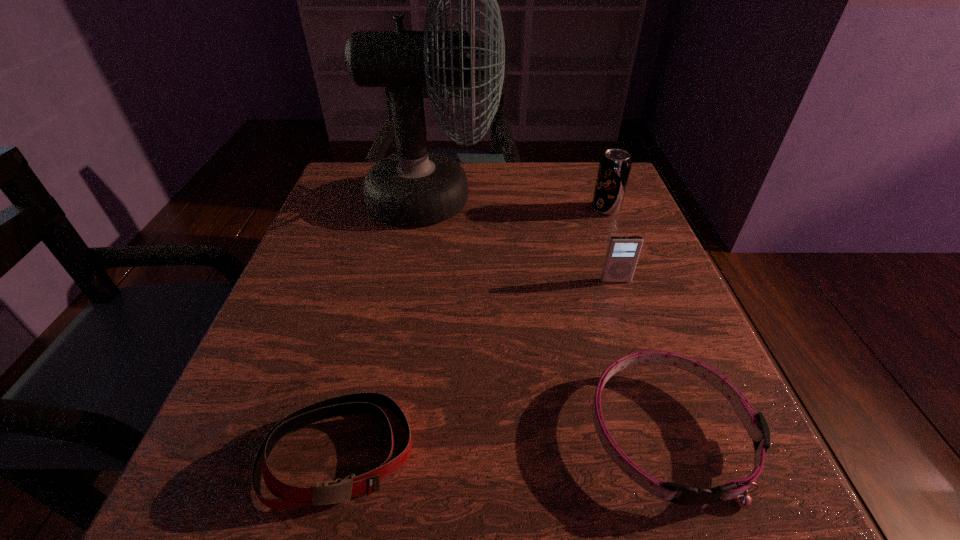
Locate an element on the screen. object at the near right corner is located at coordinates pos(756,425).

In the image, there is a desktop. Identify the location of vacant space at the far edge. [x=467, y=163].

This screenshot has width=960, height=540. What are the coordinates of `free space at the near edge of the desktop` in the screenshot? It's located at (564, 516).

In the image, there is a desktop. Where is `vacant space at the left edge`? Image resolution: width=960 pixels, height=540 pixels. vacant space at the left edge is located at coordinates (353, 276).

In the image, there is a desktop. In order to click on free space at the right edge in this screenshot , I will do `click(660, 286)`.

Find the location of `vacant space at the far left corner of the desktop`. vacant space at the far left corner of the desktop is located at coordinates (365, 162).

Where is `free region at the far right corner of the desktop`? The width and height of the screenshot is (960, 540). free region at the far right corner of the desktop is located at coordinates (585, 198).

At what (x,y) coordinates should I click in order to perform the action: click on free space between the fan and the left dog collar. Please return your answer as a coordinate pair (x, y). Looking at the image, I should click on (387, 327).

Locate an element on the screen. This screenshot has height=540, width=960. vacant area that lies between the left dog collar and the fan is located at coordinates (387, 327).

Locate an element on the screen. free area in between the second tallest object and the tallest object is located at coordinates (519, 205).